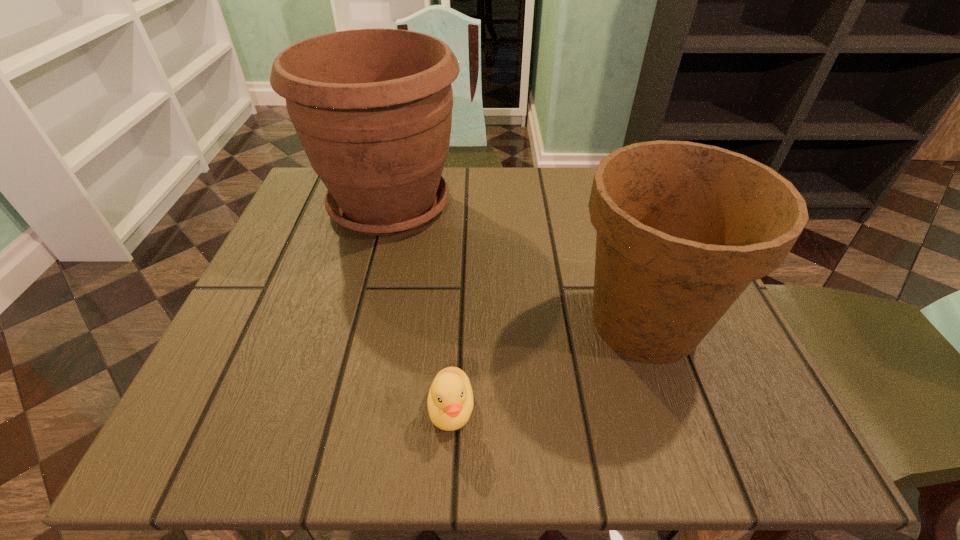
The height and width of the screenshot is (540, 960). In order to click on object positioned at the right edge in this screenshot , I will do `click(683, 228)`.

The width and height of the screenshot is (960, 540). Find the location of `object present at the far left corner`. object present at the far left corner is located at coordinates (372, 108).

In the image, there is a desktop. Identify the location of vacant region at the far edge. Image resolution: width=960 pixels, height=540 pixels. (446, 178).

This screenshot has width=960, height=540. Identify the location of vacant position at the near edge of the desktop. (572, 399).

This screenshot has width=960, height=540. In the image, there is a desktop. What are the coordinates of `vacant space at the left edge` in the screenshot? It's located at (277, 289).

I want to click on vacant space at the near left corner of the desktop, so click(x=279, y=407).

Where is `vacant region at the near right corner of the desktop`? This screenshot has height=540, width=960. vacant region at the near right corner of the desktop is located at coordinates (757, 448).

Find the location of a particular element. The width and height of the screenshot is (960, 540). blank region between the right flowerpot and the shortest object is located at coordinates (548, 366).

In order to click on free spot between the right flowerpot and the shortest object in this screenshot , I will do `click(548, 366)`.

I want to click on free area in between the left flowerpot and the second tallest object, so click(x=517, y=264).